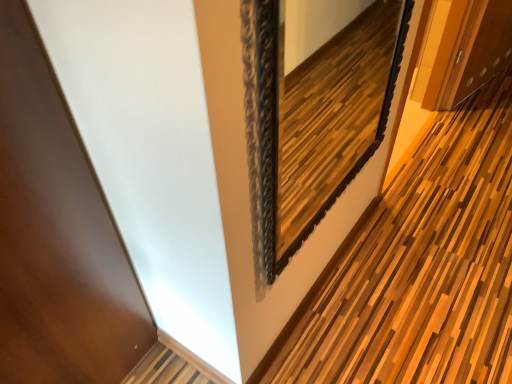
Question: Is black ornate mirror at upper center in front of or behind wooden slats at center in the image?

Choices:
 (A) front
 (B) behind

Answer: (A)

Question: From the image's perspective, relative to wooden slats at center, is black ornate mirror at upper center above or below?

Choices:
 (A) below
 (B) above

Answer: (B)

Question: Is black ornate mirror at upper center to the left or to the right of wooden slats at center in the image?

Choices:
 (A) left
 (B) right

Answer: (A)

Question: From the image's perspective, is wooden slats at center above or below black ornate mirror at upper center?

Choices:
 (A) above
 (B) below

Answer: (B)

Question: In the image, is wooden slats at center positioned in front of or behind black ornate mirror at upper center?

Choices:
 (A) behind
 (B) front

Answer: (A)

Question: Is wooden slats at center inside or outside of black ornate mirror at upper center?

Choices:
 (A) outside
 (B) inside

Answer: (A)

Question: From a real-world perspective, is wooden slats at center physically located above or below black ornate mirror at upper center?

Choices:
 (A) above
 (B) below

Answer: (B)